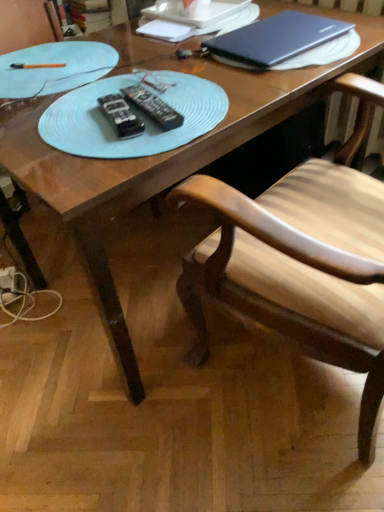
You are a GUI agent. You are given a task and a screenshot of the screen. Output one action in this format:
    pyautogui.click(x=<x>, y=<y>)
    Task: Click on the free spot to the left of wooden chair at center
    Image resolution: width=384 pixels, height=512 pixels.
    Given the screenshot: What is the action you would take?
    pyautogui.click(x=130, y=439)